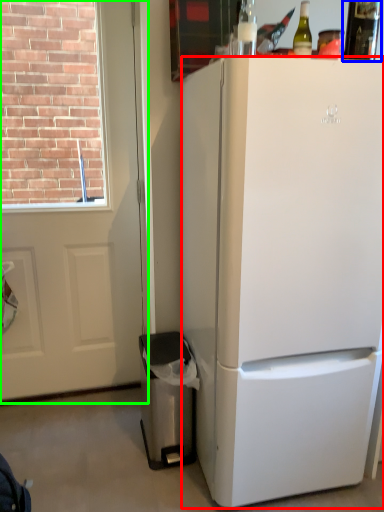
Question: Which object is the farthest from refrigerator (highlighted by a red box)? Choose among these: bottle (highlighted by a blue box) or screen door (highlighted by a green box).

Choices:
 (A) bottle
 (B) screen door

Answer: (B)